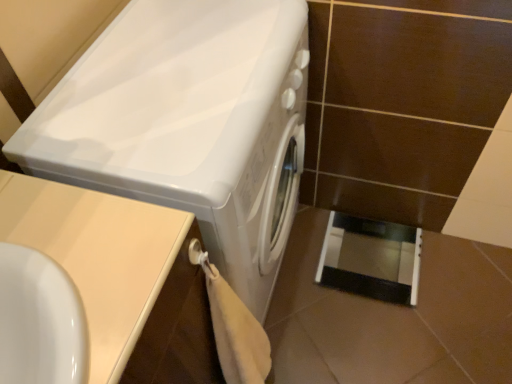
The width and height of the screenshot is (512, 384). Identify the location of empty space that is ontop of beige laminate counter top at lower left. (68, 261).